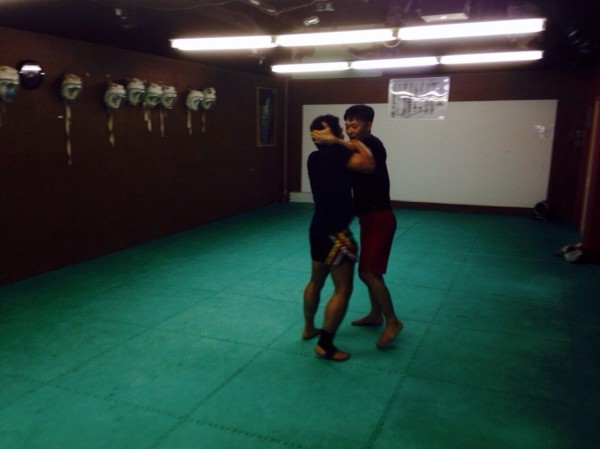
Image resolution: width=600 pixels, height=449 pixels. Find the location of `poster`. poster is located at coordinates click(421, 107).